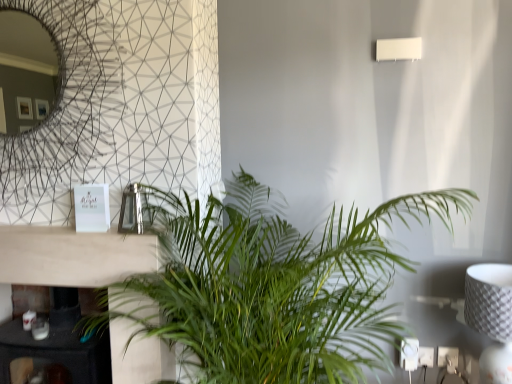
Question: Is black marble fireplace at lower left at the right side of green leafy plant at center?

Choices:
 (A) no
 (B) yes

Answer: (A)

Question: Is green leafy plant at center completely or partially inside black marble fireplace at lower left?

Choices:
 (A) yes
 (B) no

Answer: (B)

Question: From a real-world perspective, is black marble fireplace at lower left under green leafy plant at center?

Choices:
 (A) yes
 (B) no

Answer: (A)

Question: Does black marble fireplace at lower left come behind green leafy plant at center?

Choices:
 (A) no
 (B) yes

Answer: (B)

Question: Is black marble fireplace at lower left not inside green leafy plant at center?

Choices:
 (A) no
 (B) yes

Answer: (B)

Question: Looking at their shapes, would you say black marble fireplace at lower left is wider or thinner than green leafy plant at center?

Choices:
 (A) wide
 (B) thin

Answer: (B)

Question: Considering their positions, is black marble fireplace at lower left located in front of or behind green leafy plant at center?

Choices:
 (A) front
 (B) behind

Answer: (B)

Question: Considering the positions of point (113, 327) and point (170, 286), is point (113, 327) closer or farther from the camera than point (170, 286)?

Choices:
 (A) farther
 (B) closer

Answer: (A)

Question: Considering the positions of black marble fireplace at lower left and green leafy plant at center in the image, is black marble fireplace at lower left taller or shorter than green leafy plant at center?

Choices:
 (A) short
 (B) tall

Answer: (A)

Question: Is white textured lampshade at right inside the boundaries of green leafy plant at center, or outside?

Choices:
 (A) outside
 (B) inside

Answer: (A)

Question: Is point (500, 319) positioned closer to the camera than point (307, 274)?

Choices:
 (A) closer
 (B) farther

Answer: (B)

Question: Based on their positions, is white textured lampshade at right located to the left or right of green leafy plant at center?

Choices:
 (A) right
 (B) left

Answer: (A)

Question: In terms of width, does white textured lampshade at right look wider or thinner when compared to green leafy plant at center?

Choices:
 (A) wide
 (B) thin

Answer: (B)

Question: Is green leafy plant at center taller or shorter than black marble fireplace at lower left?

Choices:
 (A) tall
 (B) short

Answer: (A)

Question: In terms of size, does green leafy plant at center appear bigger or smaller than black marble fireplace at lower left?

Choices:
 (A) small
 (B) big

Answer: (B)